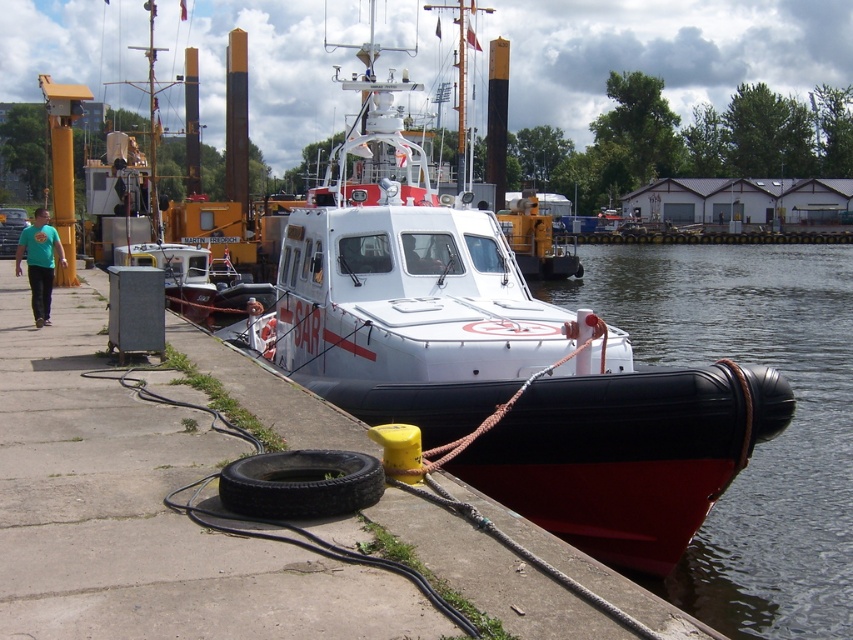
Based on the photo, you are standing at the point with coordinates (756,444) in the image. What object is located at this point?

The point corresponds to the black rubber boat at lower right.

You are a dock worker who needs to move the black rubber tire at lower center to make space for a new boat. Since the black rubber boat at lower right is currently occupying the dock, can you move the tire without needing to move the boat first?

The black rubber boat at lower right is wider than the black rubber tire at lower center. Since the tire is smaller in width, you can move it without needing to move the boat first.

From the picture: You are a dock worker who needs to move the black rubber tire at lower center to the black rubber boat at lower right. The dock has a maximum load capacity of 10 meters between any two points. Can you safely move the tire to the boat without exceeding the dock load capacity?

The black rubber boat at lower right and black rubber tire at lower center are 9.80 meters apart. Since the dock has a maximum load capacity of 10 meters between any two points, moving the tire 9.80 meters to the boat is within the safe limit.